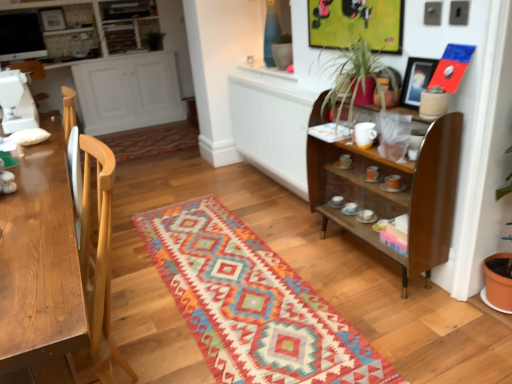
Image resolution: width=512 pixels, height=384 pixels. I want to click on free space between glossy wood shelf at upper right and multicolored woven mat at center, so click(328, 264).